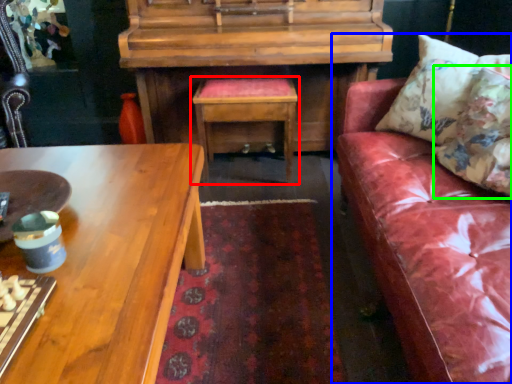
Question: Estimate the real-world distances between objects in this image. Which object is closer to table (highlighted by a red box), studio couch (highlighted by a blue box) or pillow (highlighted by a green box)?

Choices:
 (A) studio couch
 (B) pillow

Answer: (A)